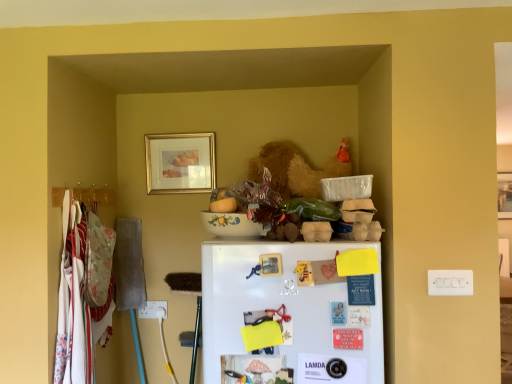
Question: Considering the relative sizes of wooden picture frame at upper right, the 1th picture frame from the right, and white matte refrigerator at center in the image provided, is wooden picture frame at upper right, the 1th picture frame from the right, wider than white matte refrigerator at center?

Choices:
 (A) yes
 (B) no

Answer: (B)

Question: Is the depth of wooden picture frame at upper right, the 1th picture frame from the right, less than that of white matte refrigerator at center?

Choices:
 (A) yes
 (B) no

Answer: (B)

Question: Would you say white matte refrigerator at center is part of wooden picture frame at upper right, which is counted as the 2th picture frame, starting from the front,'s contents?

Choices:
 (A) no
 (B) yes

Answer: (A)

Question: Is wooden picture frame at upper right, positioned as the second picture frame in left-to-right order, positioned with its back to white matte refrigerator at center?

Choices:
 (A) no
 (B) yes

Answer: (A)

Question: Is wooden picture frame at upper right, the 1th picture frame in the back-to-front sequence, outside white matte refrigerator at center?

Choices:
 (A) yes
 (B) no

Answer: (A)

Question: Looking at the image, does wooden picture frame at upper right, positioned as the second picture frame in left-to-right order, seem bigger or smaller compared to white matte refrigerator at center?

Choices:
 (A) small
 (B) big

Answer: (A)

Question: Considering the positions of wooden picture frame at upper right, the 1th picture frame in the back-to-front sequence, and white matte refrigerator at center in the image, is wooden picture frame at upper right, the 1th picture frame in the back-to-front sequence, taller or shorter than white matte refrigerator at center?

Choices:
 (A) short
 (B) tall

Answer: (B)

Question: Considering the relative positions of wooden picture frame at upper right, the 1th picture frame in the back-to-front sequence, and white matte refrigerator at center in the image provided, is wooden picture frame at upper right, the 1th picture frame in the back-to-front sequence, to the left or to the right of white matte refrigerator at center?

Choices:
 (A) right
 (B) left

Answer: (A)

Question: From a real-world perspective, relative to white matte refrigerator at center, is wooden picture frame at upper right, positioned as the second picture frame in left-to-right order, vertically above or below?

Choices:
 (A) below
 (B) above

Answer: (B)

Question: Is wooden picture frame at upper right, the 1th picture frame in the back-to-front sequence, inside the boundaries of gold-framed picture at upper center, which is the 1th picture frame from left to right, or outside?

Choices:
 (A) outside
 (B) inside

Answer: (A)

Question: From the image's perspective, is wooden picture frame at upper right, positioned as the second picture frame in left-to-right order, above or below gold-framed picture at upper center, which appears as the 1th picture frame when viewed from the front?

Choices:
 (A) above
 (B) below

Answer: (B)

Question: Based on their sizes in the image, would you say wooden picture frame at upper right, the 1th picture frame in the back-to-front sequence, is bigger or smaller than gold-framed picture at upper center, arranged as the 2th picture frame when viewed from the back?

Choices:
 (A) big
 (B) small

Answer: (A)

Question: In terms of height, does wooden picture frame at upper right, the 1th picture frame in the back-to-front sequence, look taller or shorter compared to gold-framed picture at upper center, which is counted as the 2th picture frame, starting from the right?

Choices:
 (A) tall
 (B) short

Answer: (A)

Question: Looking at the image, does gold-framed picture at upper center, arranged as the 2th picture frame when viewed from the back, seem bigger or smaller compared to wooden picture frame at upper right, positioned as the second picture frame in left-to-right order?

Choices:
 (A) big
 (B) small

Answer: (B)

Question: Looking at their shapes, would you say gold-framed picture at upper center, which is the 1th picture frame from left to right, is wider or thinner than wooden picture frame at upper right, the 1th picture frame from the right?

Choices:
 (A) thin
 (B) wide

Answer: (A)